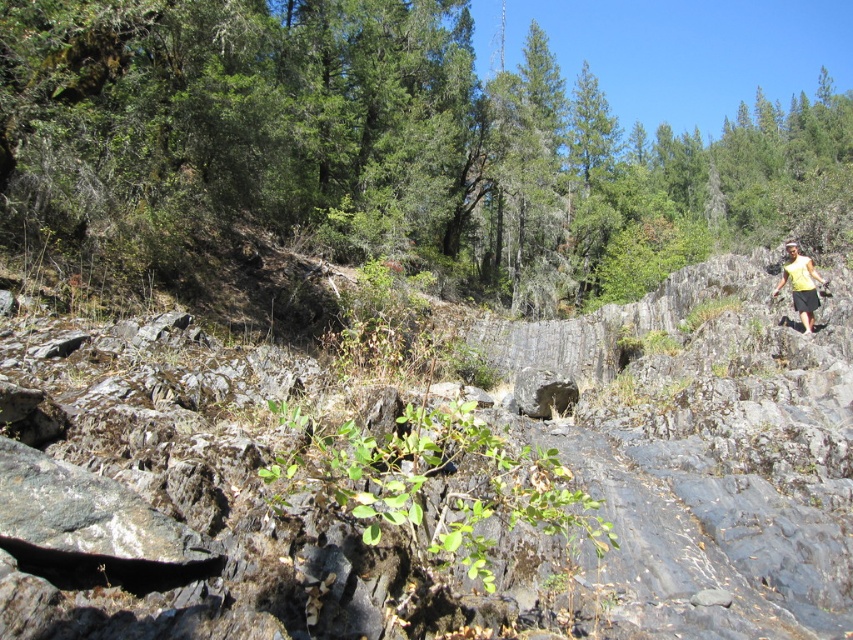
Is green leafy tree at center behind gray rough stone at center?

That is False.

Is point (138, 28) farther from viewer compared to point (524, 396)?

Yes.

Is point (810, 109) behind point (546, 413)?

That is True.

The height and width of the screenshot is (640, 853). I want to click on green leafy tree at center, so click(379, 150).

Who is positioned more to the left, green leafy tree at center or yellow fabric at right?

yellow fabric at right is more to the left.

Does point (297, 161) come in front of point (807, 305)?

That is False.

Is point (93, 12) closer to camera compared to point (799, 317)?

Yes, point (93, 12) is in front of point (799, 317).

The width and height of the screenshot is (853, 640). I want to click on green leafy tree at center, so click(379, 150).

Consider the image. Is gray rough stone at center positioned at the back of yellow fabric at right?

No, gray rough stone at center is in front of yellow fabric at right.

Does gray rough stone at center come in front of yellow fabric at right?

Yes, it is in front of yellow fabric at right.

Which is in front, point (535, 392) or point (799, 275)?

Point (535, 392) is more forward.

Locate an element on the screen. gray rough stone at center is located at coordinates pos(543,392).